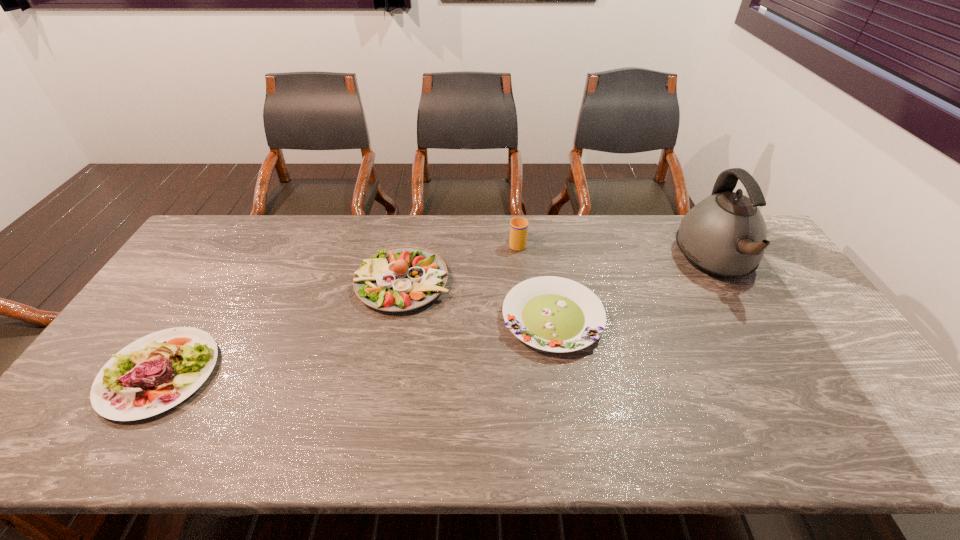
Identify which salad plate is the second nearest to the kettle. Please provide its 2D coordinates. Your answer should be formatted as a tuple, i.e. [(x, y)], where the tuple contains the x and y coordinates of a point satisfying the conditions above.

[(399, 279)]

Find the location of a particular element. salad plate that is the third closest to the cup is located at coordinates (129, 386).

The height and width of the screenshot is (540, 960). I want to click on blank area in the image that satisfies the following two spatial constraints: 1. on the back side of the leftmost salad plate; 2. on the left side of the shortest object, so click(195, 319).

The width and height of the screenshot is (960, 540). What are the coordinates of `free location that satisfies the following two spatial constraints: 1. on the front side of the second object from left to right; 2. on the left side of the shortest object` in the screenshot? It's located at (396, 319).

This screenshot has height=540, width=960. Find the location of `vacant area that satisfies the following two spatial constraints: 1. on the back side of the shortest salad plate; 2. on the left side of the leftmost salad plate`. vacant area that satisfies the following two spatial constraints: 1. on the back side of the shortest salad plate; 2. on the left side of the leftmost salad plate is located at coordinates (195, 319).